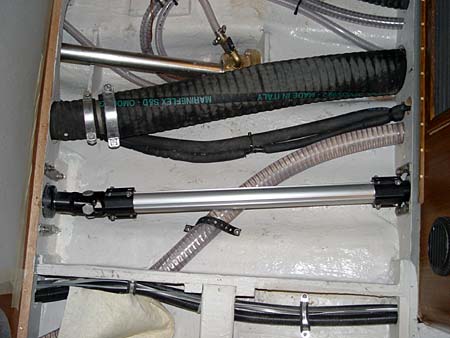
Locate an element on the screen. The width and height of the screenshot is (450, 338). drawer dividers is located at coordinates (221, 312), (406, 290).